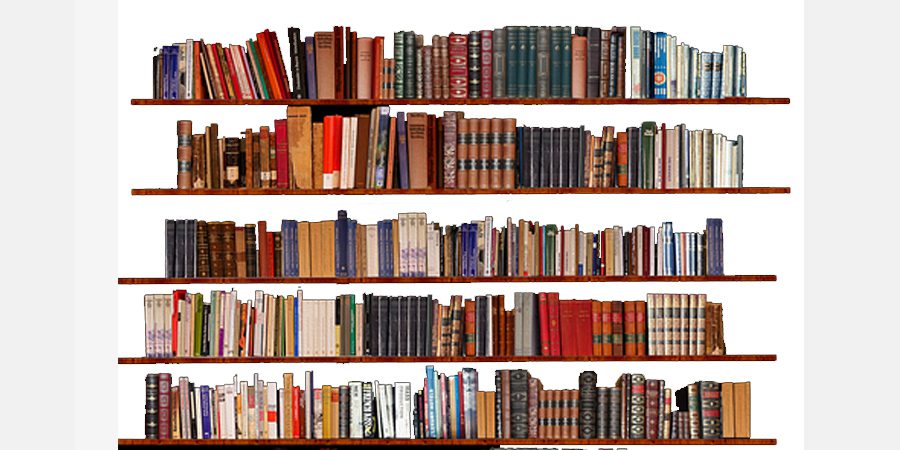
At what (x,y) coordinates should I click in order to perform the action: click on shelves. Please return your answer as a coordinate pair (x, y). The height and width of the screenshot is (450, 900). Looking at the image, I should click on pos(136,99), pos(159,189), pos(137,279), pos(138,360), pos(136,445).